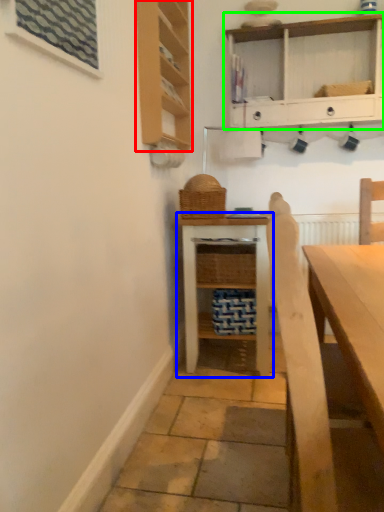
Question: Considering the real-world distances, which object is farthest from cabinetry (highlighted by a red box)? shelf (highlighted by a blue box) or shelf (highlighted by a green box)?

Choices:
 (A) shelf
 (B) shelf

Answer: (A)